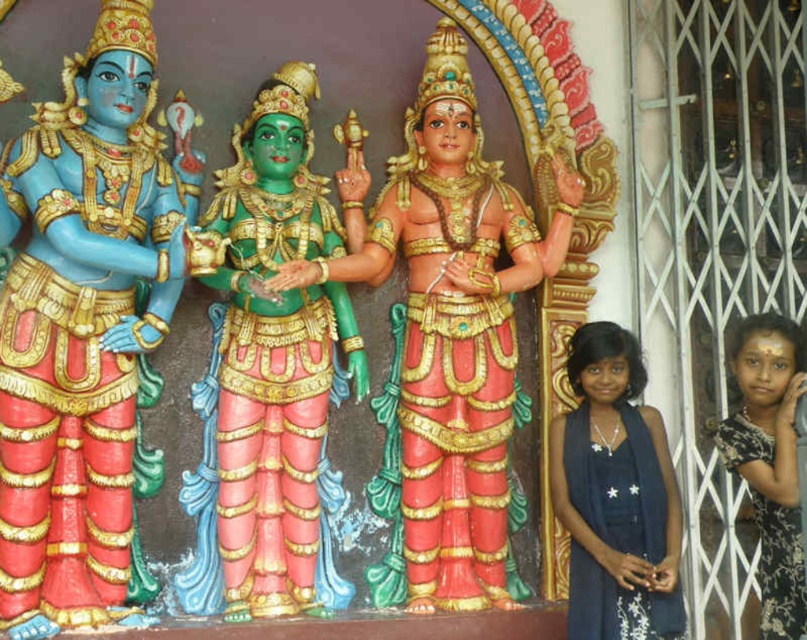
Question: Does matte blue deity at left appear over black floral dress at lower right?

Choices:
 (A) yes
 (B) no

Answer: (A)

Question: Where is green glossy statue at center located in relation to dark blue fabric dress at lower right in the image?

Choices:
 (A) left
 (B) right

Answer: (A)

Question: Which point appears closest to the camera in this image?

Choices:
 (A) (257, 388)
 (B) (420, 472)
 (C) (580, 371)

Answer: (A)

Question: Which point appears closest to the camera in this image?

Choices:
 (A) (103, 320)
 (B) (257, 387)

Answer: (A)

Question: Considering the relative positions of matte blue deity at left and black floral dress at lower right in the image provided, where is matte blue deity at left located with respect to black floral dress at lower right?

Choices:
 (A) below
 (B) above

Answer: (B)

Question: Which point is farther to the camera?

Choices:
 (A) dark blue fabric dress at lower right
 (B) polished gold statue at center

Answer: (A)